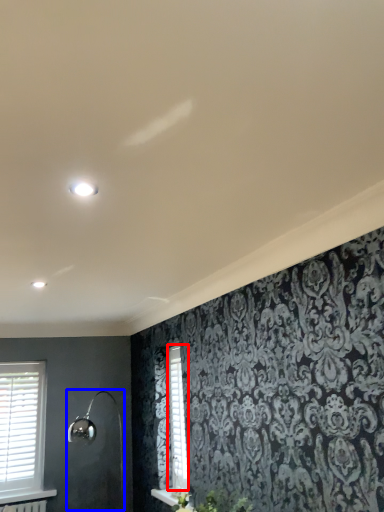
Question: Which point is closer to the camera, shutter (highlighted by a red box) or shower (highlighted by a blue box)?

Choices:
 (A) shutter
 (B) shower

Answer: (B)